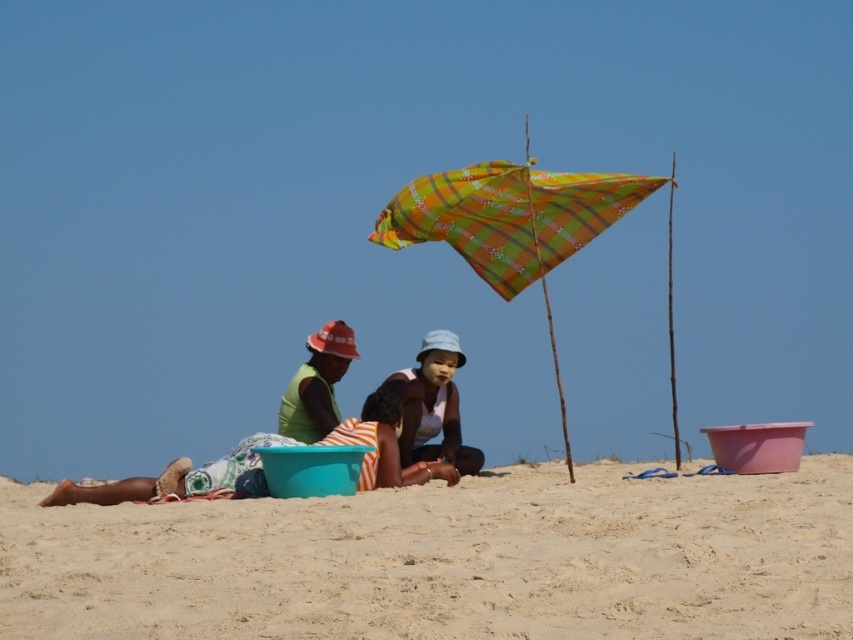
Does light blue fabric hat at center appear on the right side of striped fabric child at center?

Yes, light blue fabric hat at center is to the right of striped fabric child at center.

Is point (422, 416) positioned in front of point (456, 472)?

No, it is behind (456, 472).

Where is `light blue fabric hat at center`? This screenshot has width=853, height=640. light blue fabric hat at center is located at coordinates (433, 404).

Is green fabric shirt at center below striped fabric child at center?

Incorrect, green fabric shirt at center is not positioned below striped fabric child at center.

Consider the image. Is green fabric shirt at center positioned before striped fabric child at center?

No.

Image resolution: width=853 pixels, height=640 pixels. What do you see at coordinates (317, 385) in the screenshot? I see `green fabric shirt at center` at bounding box center [317, 385].

Identify the location of green fabric shirt at center. The width and height of the screenshot is (853, 640). (317, 385).

Is fine-grained sand at lower center positioned in front of striped fabric child at center?

Yes.

Between point (86, 608) and point (428, 465), which one is positioned behind?

Positioned behind is point (428, 465).

Is point (209, 552) positioned behind point (376, 401)?

No, it is in front of (376, 401).

You are a GUI agent. You are given a task and a screenshot of the screen. Output one action in this format:
    pyautogui.click(x=<x>, y=<y>)
    Task: Click on the fine-grained sand at lower center
    This screenshot has width=853, height=640.
    Given the screenshot: What is the action you would take?
    pyautogui.click(x=445, y=560)